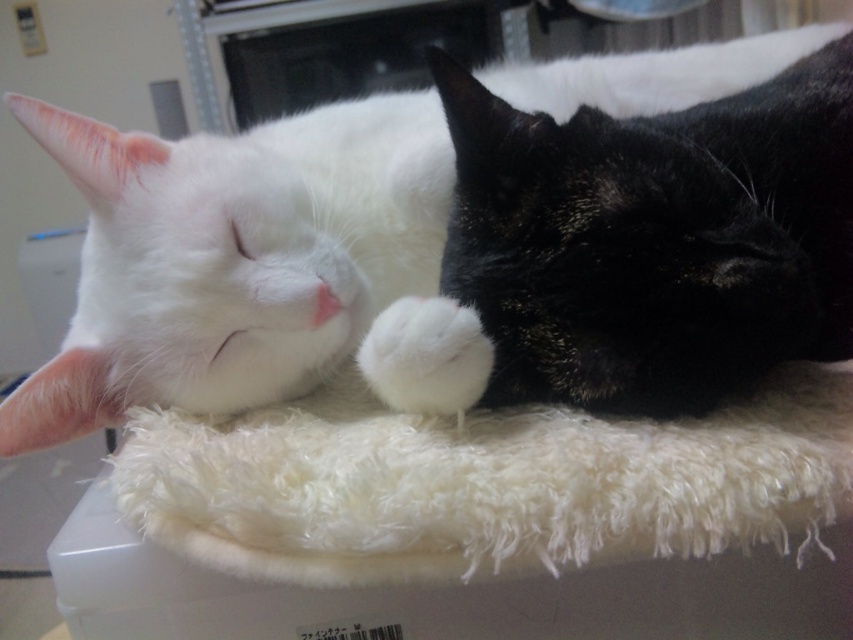
Question: Which point is farther from the camera taking this photo?

Choices:
 (A) (454, 324)
 (B) (253, 432)
 (C) (247, 168)
 (D) (548, 342)

Answer: (C)

Question: Estimate the real-world distances between objects in this image. Which object is closer to the black shaggy cat at center?

Choices:
 (A) white fluffy cat at center
 (B) white fluffy paw at center
 (C) white fluffy cat bed at center

Answer: (C)

Question: Is white fluffy box at center above white fluffy paw at center?

Choices:
 (A) yes
 (B) no

Answer: (B)

Question: Does white fluffy cat bed at center appear under white fluffy paw at center?

Choices:
 (A) yes
 (B) no

Answer: (A)

Question: Does white fluffy box at center have a smaller size compared to white fluffy paw at center?

Choices:
 (A) yes
 (B) no

Answer: (B)

Question: Estimate the real-world distances between objects in this image. Which object is closer to the white fluffy box at center?

Choices:
 (A) black shaggy cat at center
 (B) white fluffy cat at center

Answer: (A)